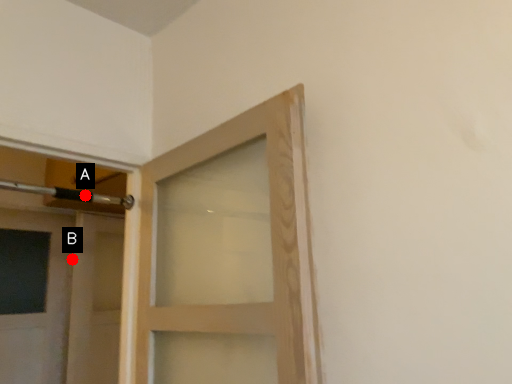
Question: Two points are circled on the image, labeled by A and B beside each circle. Which point is farther from the camera taking this photo?

Choices:
 (A) A is further
 (B) B is further

Answer: (B)